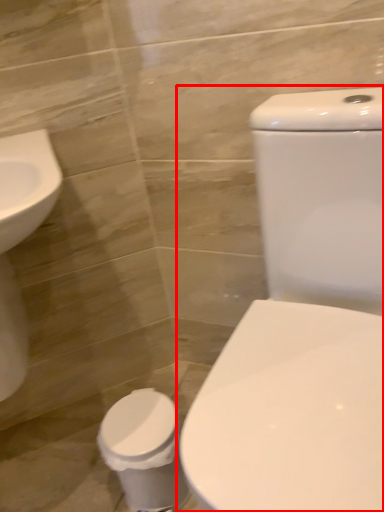
Question: From the image's perspective, where is toilet (annotated by the red box) located relative to toilet bowl?

Choices:
 (A) above
 (B) below

Answer: (A)